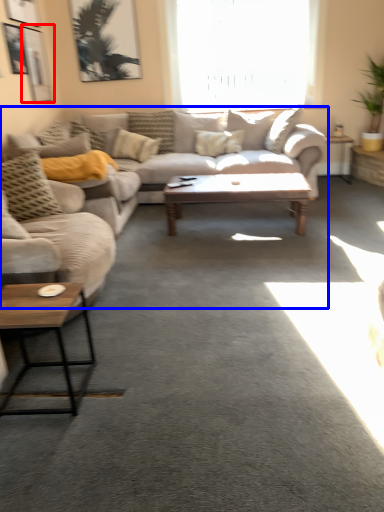
Question: Among these objects, which one is farthest to the camera, picture frame (highlighted by a red box) or studio couch (highlighted by a blue box)?

Choices:
 (A) picture frame
 (B) studio couch

Answer: (A)